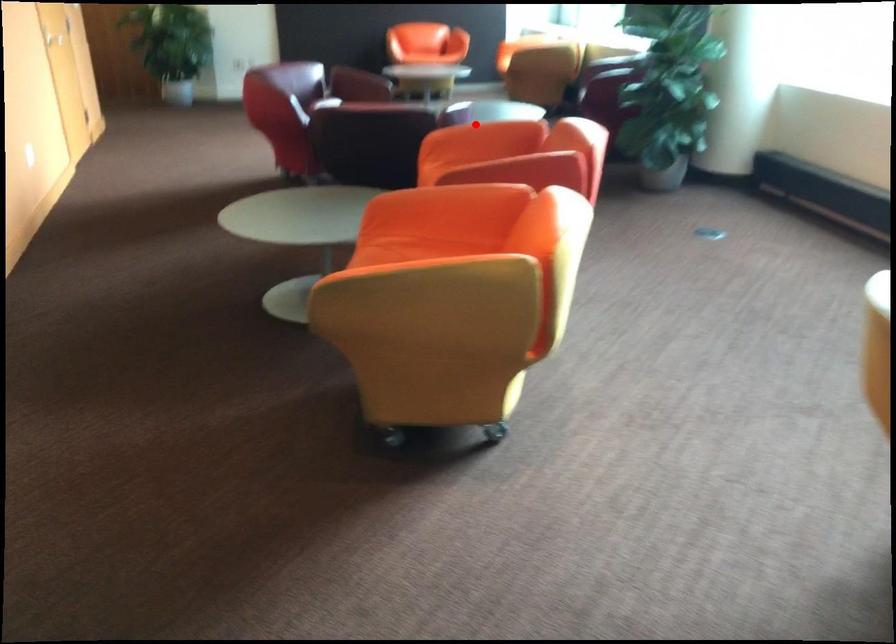
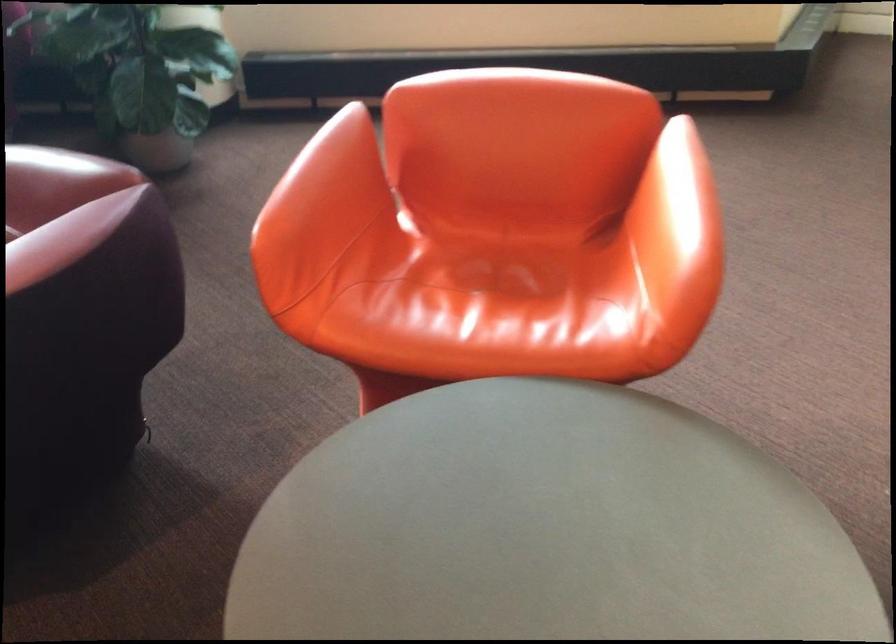
Question: I am providing you with two images of the same scene from different viewpoints. In image1, a red point is highlighted. Considering the same 3D point in image2, which of the following is correct?

Choices:
 (A) It is closer
 (B) It is farther

Answer: (A)